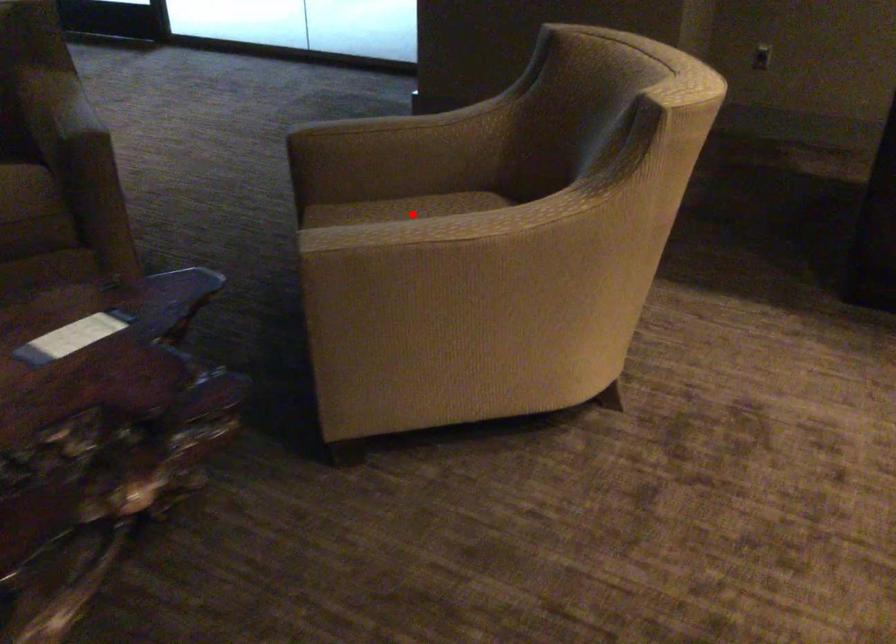
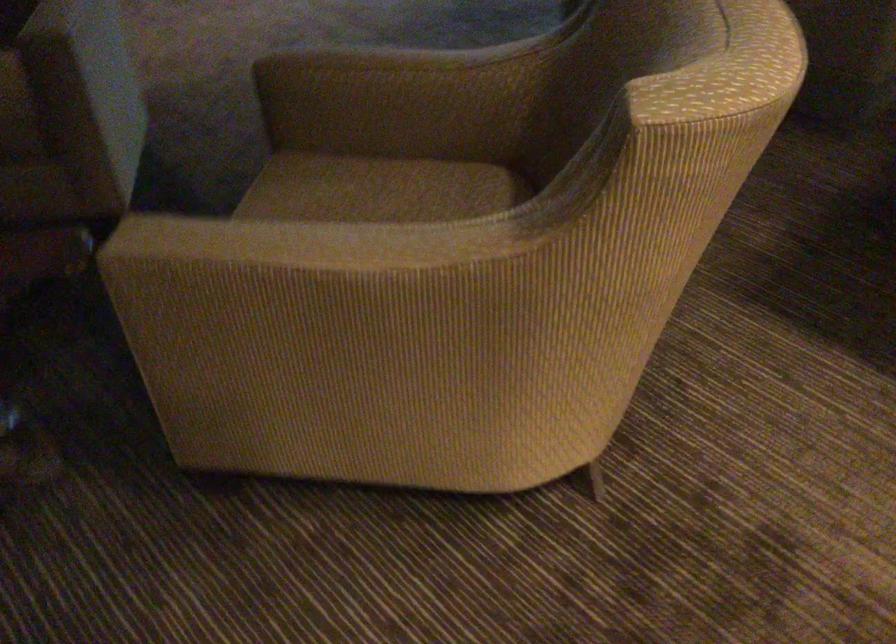
Question: I am providing you with two images of the same scene from different viewpoints. Given a red point in image1, look at the same physical point in image2. Is it:

Choices:
 (A) Closer to the viewpoint
 (B) Farther from the viewpoint

Answer: (A)